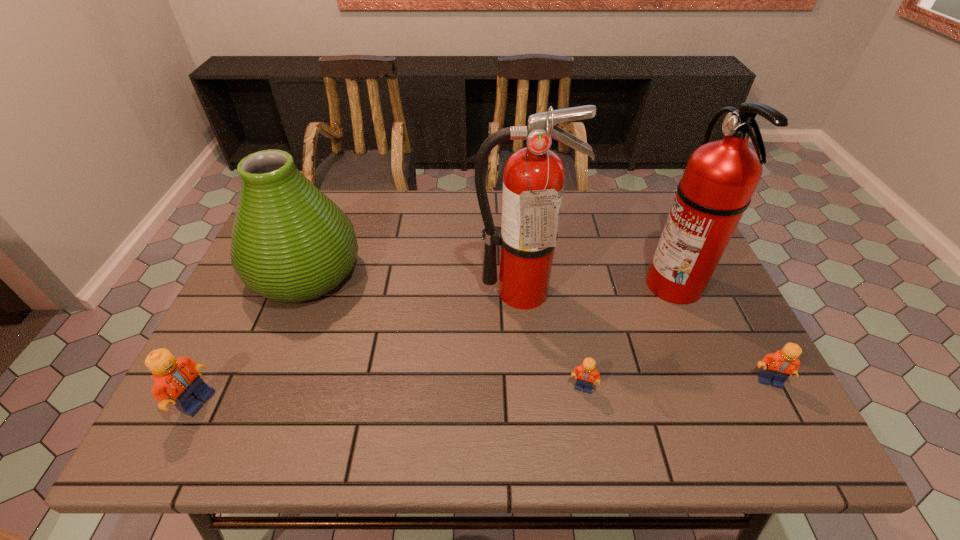
You are a GUI agent. You are given a task and a screenshot of the screen. Output one action in this format:
    pyautogui.click(x=<x>, y=<y>)
    Task: Click on the fourth tallest object
    
    Given the screenshot: What is the action you would take?
    pyautogui.click(x=178, y=379)

Locate an element on the screen. The height and width of the screenshot is (540, 960). the tallest Lego is located at coordinates (178, 379).

Identify the location of the second Lego from left to right. The height and width of the screenshot is (540, 960). (587, 375).

I want to click on the shortest Lego, so click(x=587, y=375).

You are a GUI agent. You are given a task and a screenshot of the screen. Output one action in this format:
    pyautogui.click(x=<x>, y=<y>)
    Task: Click on the rightmost object
    
    Given the screenshot: What is the action you would take?
    pyautogui.click(x=777, y=367)

You are a GUI agent. You are given a task and a screenshot of the screen. Output one action in this format:
    pyautogui.click(x=<x>, y=<y>)
    Task: Click on the fifth tallest object
    This screenshot has height=540, width=960.
    Given the screenshot: What is the action you would take?
    pyautogui.click(x=777, y=367)

At what (x,y) coordinates should I click in order to perform the action: click on the third tallest object. Please return your answer as a coordinate pair (x, y). Image resolution: width=960 pixels, height=540 pixels. Looking at the image, I should click on (290, 243).

Where is `the right fire extinguisher`? The width and height of the screenshot is (960, 540). the right fire extinguisher is located at coordinates (720, 178).

Image resolution: width=960 pixels, height=540 pixels. I want to click on the left fire extinguisher, so click(533, 180).

In order to click on vacant space located 0.170m on the front-facing side of the third shortest object in this screenshot , I will do `click(292, 402)`.